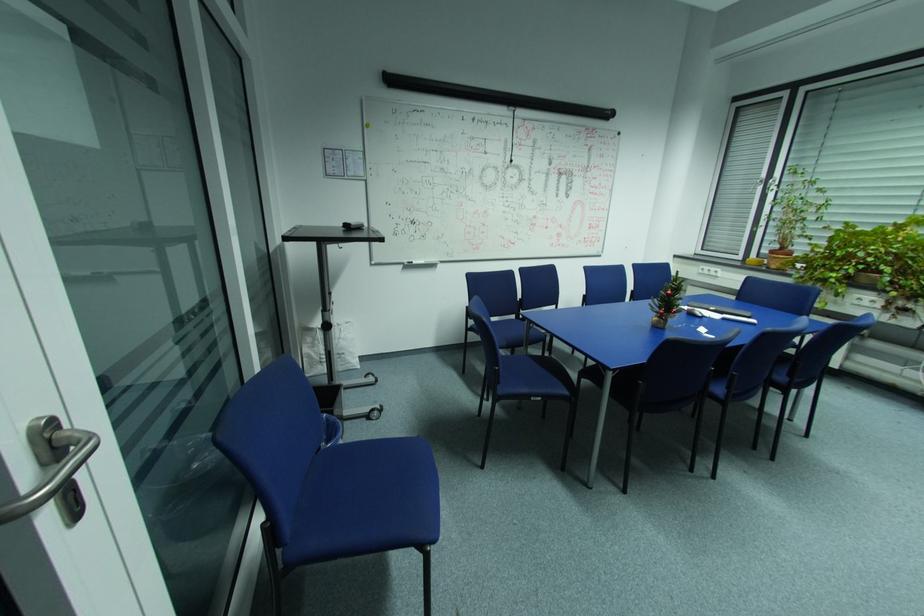
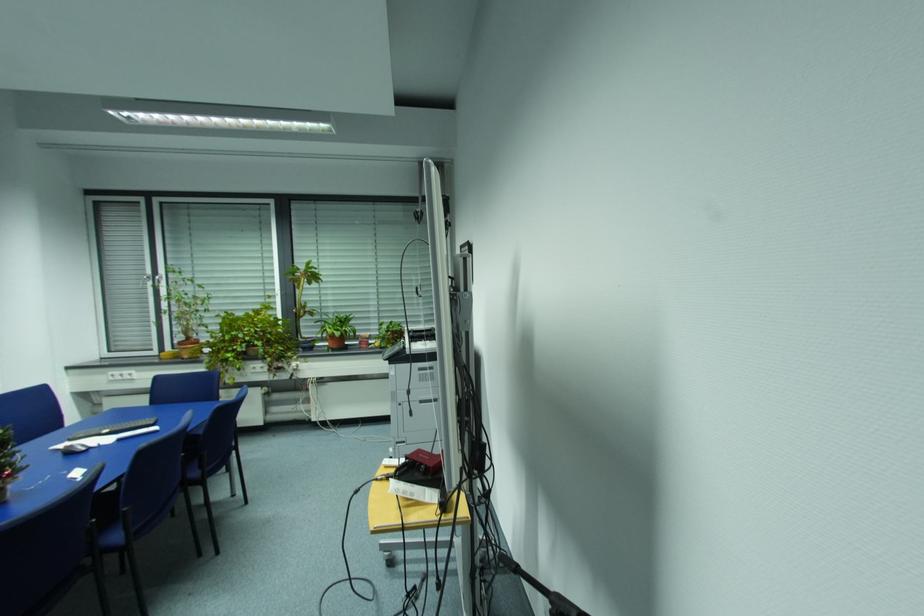
Question: How did the camera likely rotate?

Choices:
 (A) Left
 (B) Right
 (C) Up
 (D) Down

Answer: (B)